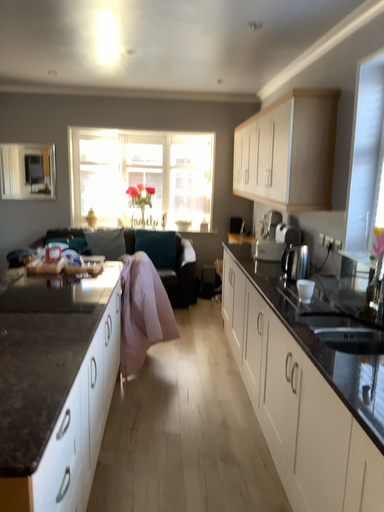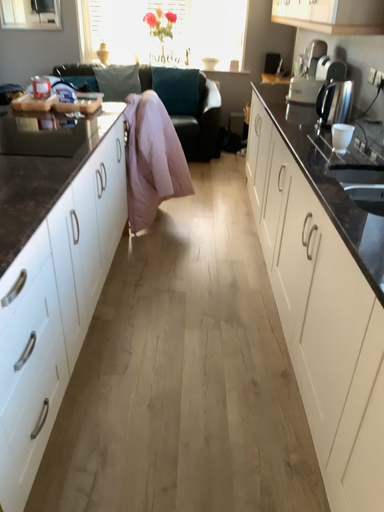
Question: How did the camera likely rotate when shooting the video?

Choices:
 (A) rotated downward
 (B) rotated upward

Answer: (A)